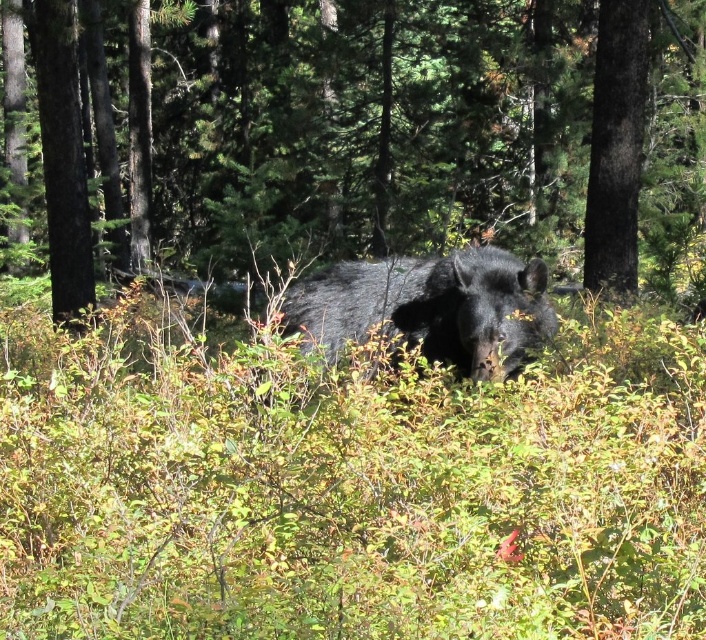
Can you confirm if brown textured tree trunk at center is positioned to the left of shiny black bear at center?

Indeed, brown textured tree trunk at center is positioned on the left side of shiny black bear at center.

Who is positioned more to the left, brown textured tree trunk at center or shiny black bear at center?

brown textured tree trunk at center

Does point (280, 236) come behind point (479, 348)?

Yes, point (280, 236) is behind point (479, 348).

Locate an element on the screen. This screenshot has height=640, width=706. brown textured tree trunk at center is located at coordinates (369, 125).

This screenshot has width=706, height=640. What do you see at coordinates (369, 125) in the screenshot? I see `brown textured tree trunk at center` at bounding box center [369, 125].

Is point (477, 115) in front of point (602, 108)?

No, (477, 115) is behind (602, 108).

Measure the distance between point [1,160] and camera.

Point [1,160] and camera are 24.92 meters apart.

Where is `brown textured tree trunk at center`? brown textured tree trunk at center is located at coordinates (369, 125).

Does shiny black bear at center have a smaller size compared to smooth dark brown tree trunk at right?

No, shiny black bear at center is not smaller than smooth dark brown tree trunk at right.

Measure the distance between shiny black bear at center and camera.

shiny black bear at center and camera are 18.45 feet apart.

Find the location of a particular element. Image resolution: width=706 pixels, height=640 pixels. shiny black bear at center is located at coordinates (430, 307).

This screenshot has width=706, height=640. In order to click on shiny black bear at center in this screenshot , I will do `click(430, 307)`.